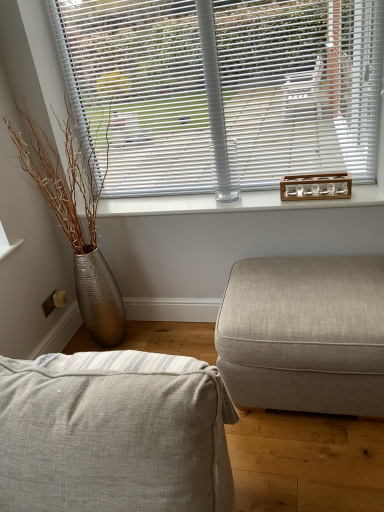
What do you see at coordinates (232, 203) in the screenshot? The height and width of the screenshot is (512, 384). I see `clear glass bottle at center` at bounding box center [232, 203].

Describe the element at coordinates (304, 334) in the screenshot. I see `textured beige ottoman at right, acting as the 2th studio couch starting from the left` at that location.

What is the approximate width of white plastic blinds at upper center?

white plastic blinds at upper center is 2.08 inches wide.

This screenshot has height=512, width=384. Find the location of `textured beige fabric couch at lower center, which appears as the first studio couch when viewed from the left`. textured beige fabric couch at lower center, which appears as the first studio couch when viewed from the left is located at coordinates (114, 434).

Is white plastic blinds at upper center next to clear glass bottle at center and touching it?

No, white plastic blinds at upper center is not in contact with clear glass bottle at center.

Which point is more distant from viewer, (x=111, y=49) or (x=345, y=205)?

Point (x=111, y=49)

Consider the image. Who is more distant, white plastic blinds at upper center or clear glass bottle at center?

clear glass bottle at center is behind.

Which is more to the right, textured beige fabric couch at lower center, which appears as the first studio couch when viewed from the left, or white plastic blinds at upper center?

From the viewer's perspective, white plastic blinds at upper center appears more on the right side.

Considering the sizes of objects textured beige fabric couch at lower center, which appears as the first studio couch when viewed from the left, and white plastic blinds at upper center in the image provided, who is wider, textured beige fabric couch at lower center, which appears as the first studio couch when viewed from the left, or white plastic blinds at upper center?

textured beige fabric couch at lower center, which appears as the first studio couch when viewed from the left.

Find the location of a particular element. The image size is (384, 512). window blind located on the right of textured beige fabric couch at lower center, the second studio couch positioned from the right is located at coordinates [x=300, y=86].

Is textured beige fabric couch at lower center, the second studio couch positioned from the right, situated inside white plastic blinds at upper center or outside?

textured beige fabric couch at lower center, the second studio couch positioned from the right, is not enclosed by white plastic blinds at upper center.

Is textured beige ottoman at right, which ranks as the first studio couch in back-to-front order, aimed at clear glass bottle at center?

No, textured beige ottoman at right, which ranks as the first studio couch in back-to-front order, is not turned towards clear glass bottle at center.

Consider the image. Is textured beige ottoman at right, marked as the first studio couch in a right-to-left arrangement, beside clear glass bottle at center?

There is a gap between textured beige ottoman at right, marked as the first studio couch in a right-to-left arrangement, and clear glass bottle at center.

Which object is more forward, textured beige ottoman at right, marked as the first studio couch in a right-to-left arrangement, or clear glass bottle at center?

textured beige ottoman at right, marked as the first studio couch in a right-to-left arrangement, is in front.

Which object is positioned more to the left, textured beige ottoman at right, acting as the 2th studio couch starting from the left, or clear glass bottle at center?

clear glass bottle at center is more to the left.

Considering the sizes of objects clear glass bottle at center and textured beige fabric couch at lower center, which is counted as the second studio couch, starting from the back, in the image provided, who is thinner, clear glass bottle at center or textured beige fabric couch at lower center, which is counted as the second studio couch, starting from the back,?

clear glass bottle at center.

Measure the distance from clear glass bottle at center to textured beige fabric couch at lower center, which is the 1th studio couch in front-to-back order.

clear glass bottle at center is 1.24 meters away from textured beige fabric couch at lower center, which is the 1th studio couch in front-to-back order.

Considering the relative positions of clear glass bottle at center and textured beige fabric couch at lower center, which is counted as the second studio couch, starting from the back, in the image provided, is clear glass bottle at center to the right of textured beige fabric couch at lower center, which is counted as the second studio couch, starting from the back, from the viewer's perspective?

Indeed, clear glass bottle at center is positioned on the right side of textured beige fabric couch at lower center, which is counted as the second studio couch, starting from the back.

From the picture: From a real-world perspective, is clear glass bottle at center above or below textured beige fabric couch at lower center, which is counted as the second studio couch, starting from the back?

In terms of real-world spatial position, clear glass bottle at center is above textured beige fabric couch at lower center, which is counted as the second studio couch, starting from the back.

Based on their sizes in the image, would you say textured beige ottoman at right, acting as the 2th studio couch starting from the left, is bigger or smaller than textured beige fabric couch at lower center, which appears as the first studio couch when viewed from the left?

Clearly, textured beige ottoman at right, acting as the 2th studio couch starting from the left, is smaller in size than textured beige fabric couch at lower center, which appears as the first studio couch when viewed from the left.

Considering the sizes of objects textured beige ottoman at right, arranged as the second studio couch when viewed from the front, and textured beige fabric couch at lower center, the second studio couch positioned from the right, in the image provided, who is thinner, textured beige ottoman at right, arranged as the second studio couch when viewed from the front, or textured beige fabric couch at lower center, the second studio couch positioned from the right,?

textured beige fabric couch at lower center, the second studio couch positioned from the right.

Could you tell me if textured beige ottoman at right, acting as the 2th studio couch starting from the left, is facing textured beige fabric couch at lower center, which appears as the first studio couch when viewed from the left?

Yes, textured beige ottoman at right, acting as the 2th studio couch starting from the left, is aimed at textured beige fabric couch at lower center, which appears as the first studio couch when viewed from the left.

Does textured beige ottoman at right, which ranks as the first studio couch in back-to-front order, come in front of textured beige fabric couch at lower center, which is counted as the second studio couch, starting from the back?

That is False.

Is white plastic blinds at upper center completely or partially inside textured beige ottoman at right, acting as the 2th studio couch starting from the left?

Definitely not — white plastic blinds at upper center is not inside textured beige ottoman at right, acting as the 2th studio couch starting from the left.

Does textured beige ottoman at right, marked as the first studio couch in a right-to-left arrangement, turn towards white plastic blinds at upper center?

No, textured beige ottoman at right, marked as the first studio couch in a right-to-left arrangement, is not turned towards white plastic blinds at upper center.

In terms of height, does textured beige ottoman at right, acting as the 2th studio couch starting from the left, look taller or shorter compared to white plastic blinds at upper center?

Clearly, textured beige ottoman at right, acting as the 2th studio couch starting from the left, is shorter compared to white plastic blinds at upper center.

How far apart are textured beige ottoman at right, acting as the 2th studio couch starting from the left, and white plastic blinds at upper center?

textured beige ottoman at right, acting as the 2th studio couch starting from the left, is 32.46 inches away from white plastic blinds at upper center.

Can you confirm if white plastic blinds at upper center is shorter than textured beige ottoman at right, acting as the 2th studio couch starting from the left?

Incorrect, the height of white plastic blinds at upper center does not fall short of that of textured beige ottoman at right, acting as the 2th studio couch starting from the left.

Visually, is white plastic blinds at upper center positioned to the left or to the right of textured beige ottoman at right, acting as the 2th studio couch starting from the left?

Clearly, white plastic blinds at upper center is on the left of textured beige ottoman at right, acting as the 2th studio couch starting from the left, in the image.

From the image's perspective, is white plastic blinds at upper center on top of textured beige ottoman at right, arranged as the second studio couch when viewed from the front?

Yes.

Does white plastic blinds at upper center contain textured beige ottoman at right, marked as the first studio couch in a right-to-left arrangement?

Actually, textured beige ottoman at right, marked as the first studio couch in a right-to-left arrangement, is outside white plastic blinds at upper center.

Where is `window sill behind the white plastic blinds at upper center`? This screenshot has width=384, height=512. window sill behind the white plastic blinds at upper center is located at coordinates (232, 203).

The height and width of the screenshot is (512, 384). What are the coordinates of `studio couch that appears on the left of white plastic blinds at upper center` in the screenshot? It's located at (114, 434).

Looking at this image, which object lies nearer to the anchor point textured beige fabric couch at lower center, which is counted as the second studio couch, starting from the back, textured beige ottoman at right, marked as the first studio couch in a right-to-left arrangement, or clear glass bottle at center?

textured beige ottoman at right, marked as the first studio couch in a right-to-left arrangement, is positioned closer to the anchor textured beige fabric couch at lower center, which is counted as the second studio couch, starting from the back.

Which object lies nearer to the anchor point textured beige ottoman at right, which ranks as the first studio couch in back-to-front order, clear glass bottle at center or white plastic blinds at upper center?

The object closer to textured beige ottoman at right, which ranks as the first studio couch in back-to-front order, is clear glass bottle at center.

When comparing their distances from textured beige fabric couch at lower center, which is the 1th studio couch in front-to-back order, does white plastic blinds at upper center or clear glass bottle at center seem closer?

clear glass bottle at center.

Considering their positions, is textured beige ottoman at right, which ranks as the first studio couch in back-to-front order, positioned further to clear glass bottle at center than white plastic blinds at upper center?

textured beige ottoman at right, which ranks as the first studio couch in back-to-front order.

Estimate the real-world distances between objects in this image. Which object is further from textured beige ottoman at right, which ranks as the first studio couch in back-to-front order, white plastic blinds at upper center or textured beige fabric couch at lower center, which is the 1th studio couch in front-to-back order?

white plastic blinds at upper center is further to textured beige ottoman at right, which ranks as the first studio couch in back-to-front order.

Considering their positions, is textured beige fabric couch at lower center, which is the 1th studio couch in front-to-back order, positioned further to textured beige ottoman at right, which ranks as the first studio couch in back-to-front order, than white plastic blinds at upper center?

white plastic blinds at upper center.

Estimate the real-world distances between objects in this image. Which object is closer to textured beige ottoman at right, which ranks as the first studio couch in back-to-front order, clear glass bottle at center or textured beige fabric couch at lower center, which is counted as the second studio couch, starting from the back?

clear glass bottle at center lies closer to textured beige ottoman at right, which ranks as the first studio couch in back-to-front order, than the other object.

Estimate the real-world distances between objects in this image. Which object is further from white plastic blinds at upper center, clear glass bottle at center or textured beige ottoman at right, which ranks as the first studio couch in back-to-front order?

Among the two, textured beige ottoman at right, which ranks as the first studio couch in back-to-front order, is located further to white plastic blinds at upper center.

The height and width of the screenshot is (512, 384). Identify the location of studio couch between textured beige fabric couch at lower center, which is counted as the second studio couch, starting from the back, and clear glass bottle at center from front to back. (304, 334).

What are the coordinates of `studio couch between white plastic blinds at upper center and textured beige fabric couch at lower center, which is counted as the second studio couch, starting from the back, vertically` in the screenshot? It's located at (304, 334).

The width and height of the screenshot is (384, 512). Find the location of `window sill between white plastic blinds at upper center and textured beige ottoman at right, which ranks as the first studio couch in back-to-front order, in the vertical direction`. window sill between white plastic blinds at upper center and textured beige ottoman at right, which ranks as the first studio couch in back-to-front order, in the vertical direction is located at coordinates (232, 203).

Where is `window blind positioned between textured beige fabric couch at lower center, which is the 1th studio couch in front-to-back order, and clear glass bottle at center from near to far`? The height and width of the screenshot is (512, 384). window blind positioned between textured beige fabric couch at lower center, which is the 1th studio couch in front-to-back order, and clear glass bottle at center from near to far is located at coordinates (300, 86).